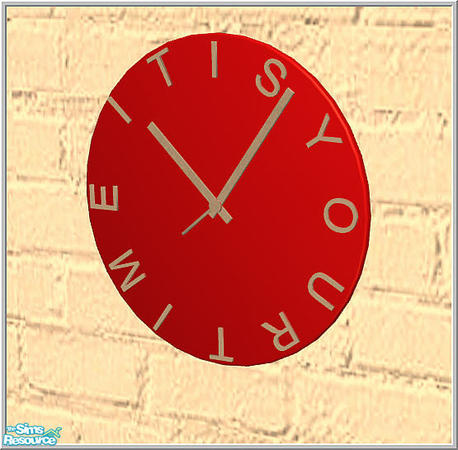
Where is `wall`? This screenshot has width=458, height=450. wall is located at coordinates (391, 269).